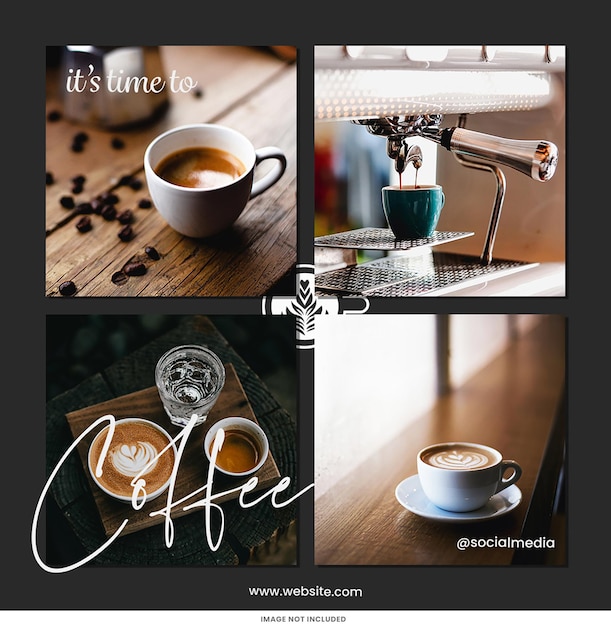
Find the location of `cups`. cups is located at coordinates (219, 453), (184, 387), (137, 475), (431, 478), (418, 207), (180, 186).